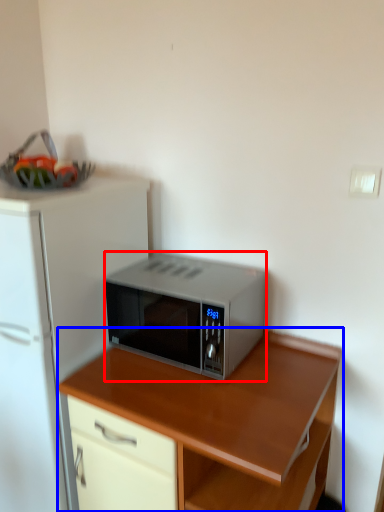
Question: Which object is further to the camera taking this photo, microwave oven (highlighted by a red box) or desk (highlighted by a blue box)?

Choices:
 (A) microwave oven
 (B) desk

Answer: (A)